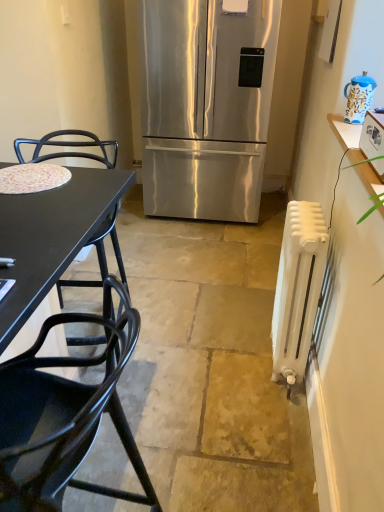
Locate an element on the screen. The image size is (384, 512). vacant space behind white matte radiator at right is located at coordinates (250, 322).